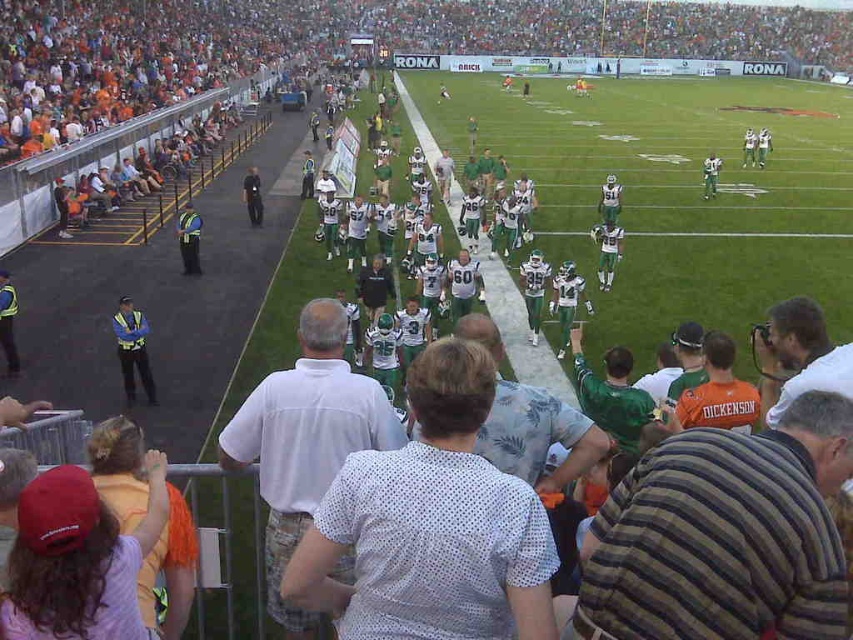
Is reflective yellow vest at center below white jersey at center?

Yes.

This screenshot has height=640, width=853. Find the location of `reflective yellow vest at center`. reflective yellow vest at center is located at coordinates (189, 237).

This screenshot has width=853, height=640. In order to click on reflective yellow vest at center in this screenshot , I will do `click(189, 237)`.

Based on the photo, between reflective yellow vest at left and reflective yellow vest at center, which one is positioned lower?

reflective yellow vest at left is lower down.

Does reflective yellow vest at left come behind reflective yellow vest at center?

No, it is not.

Is point (131, 380) positioned before point (201, 224)?

Yes.

Find the location of a particular element. This screenshot has height=640, width=853. reflective yellow vest at left is located at coordinates tap(132, 348).

Looking at this image, is reflective yellow vest at left above white jersey at center?

Result: Incorrect, reflective yellow vest at left is not positioned above white jersey at center.

Does point (126, 320) lie in front of point (712, 168)?

Yes, it is.

Which is in front, point (149, 397) or point (705, 179)?

Point (149, 397) is more forward.

You are a GUI agent. You are given a task and a screenshot of the screen. Output one action in this format:
    pyautogui.click(x=<x>, y=<y>)
    Task: Click on the reflective yellow vest at left
    
    Given the screenshot: What is the action you would take?
    pyautogui.click(x=132, y=348)